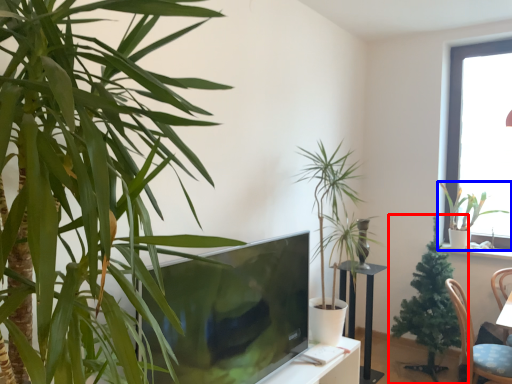
Question: Which of the following is the closest to the observer, houseplant (highlighted by a red box) or houseplant (highlighted by a blue box)?

Choices:
 (A) houseplant
 (B) houseplant

Answer: (A)